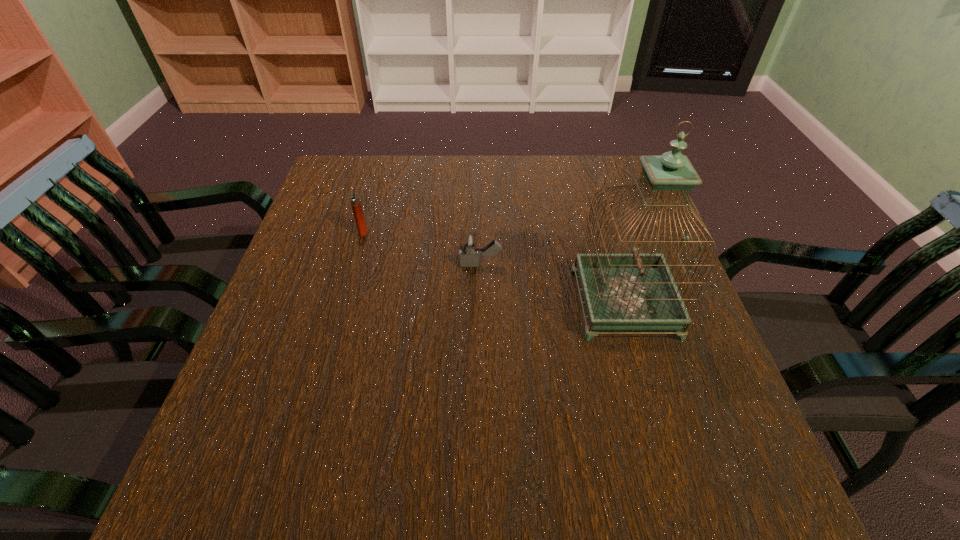
Identify the location of empty location between the nearer igniter and the tallest object. (552, 284).

Find the location of a particular element. This screenshot has height=540, width=960. unoccupied position between the birdcage and the farthest object is located at coordinates (493, 267).

Where is `unoccupied area between the second object from left to right and the farthest object`? The height and width of the screenshot is (540, 960). unoccupied area between the second object from left to right and the farthest object is located at coordinates (421, 248).

This screenshot has height=540, width=960. What are the coordinates of `free space between the second object from right to left and the birdcage` in the screenshot? It's located at (552, 284).

Locate an element on the screen. This screenshot has width=960, height=540. free spot between the farther igniter and the right igniter is located at coordinates (421, 248).

This screenshot has height=540, width=960. Find the location of `empty location between the farther igniter and the tallest object`. empty location between the farther igniter and the tallest object is located at coordinates (493, 267).

Identify the location of vacant space that's between the right igniter and the birdcage. The image size is (960, 540). (552, 284).

Identify which object is located as the second nearest to the right igniter. Please provide its 2D coordinates. Your answer should be formatted as a tuple, i.e. [(x, y)], where the tuple contains the x and y coordinates of a point satisfying the conditions above.

[(355, 200)]

Where is `object that is the closest one to the second object from right to left`? The image size is (960, 540). object that is the closest one to the second object from right to left is located at coordinates (635, 291).